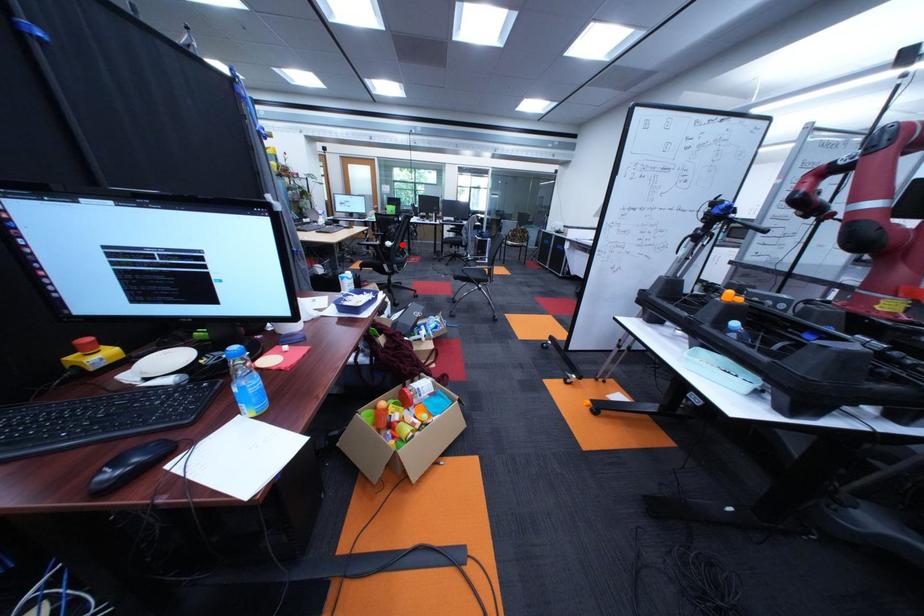
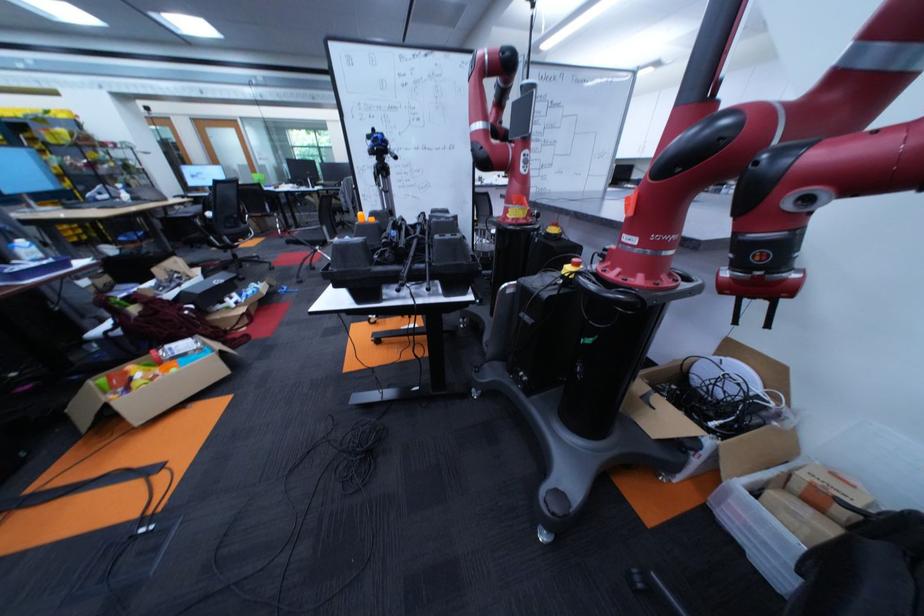
Where in the second image is the point corresponding to the highlighted location from the first image?

(224, 215)